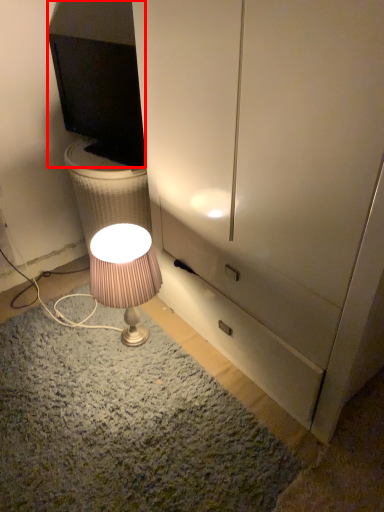
Question: From the image's perspective, what is the correct spatial positioning of television (annotated by the red box) in reference to lamp?

Choices:
 (A) below
 (B) above

Answer: (B)